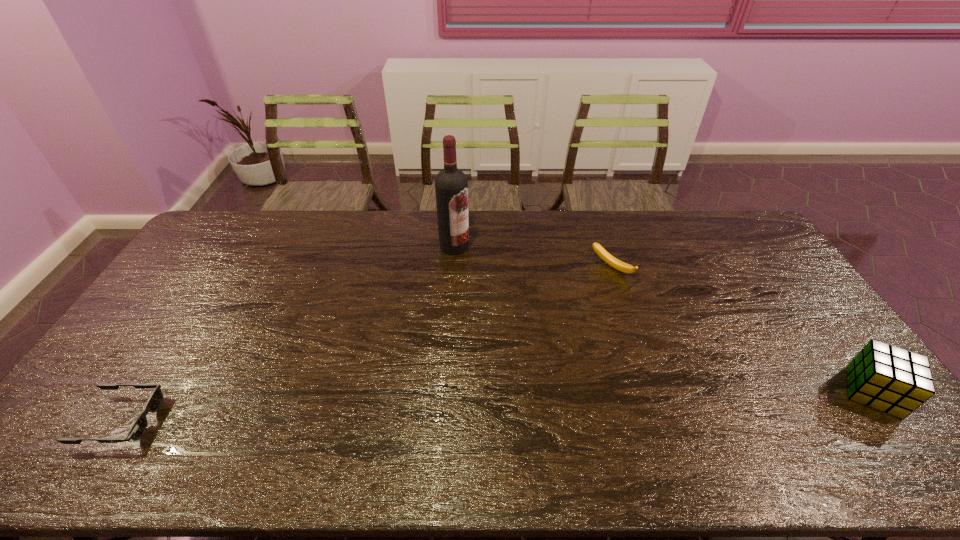
Find the location of `blank area in the image that satisfies the following two spatial constraints: 1. on the front side of the third shortest object; 2. on the right side of the second shortest object`. blank area in the image that satisfies the following two spatial constraints: 1. on the front side of the third shortest object; 2. on the right side of the second shortest object is located at coordinates [x=651, y=392].